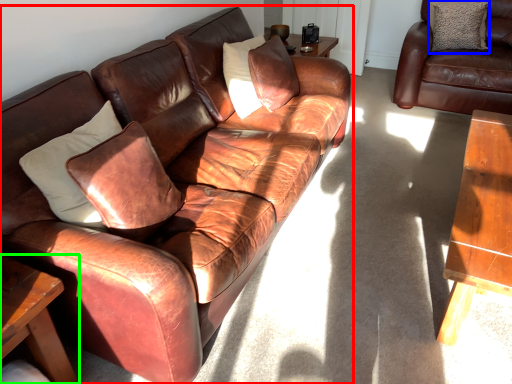
Question: Estimate the real-world distances between objects in this image. Which object is farther from studio couch (highlighted by a red box), pillow (highlighted by a blue box) or table (highlighted by a green box)?

Choices:
 (A) pillow
 (B) table

Answer: (A)